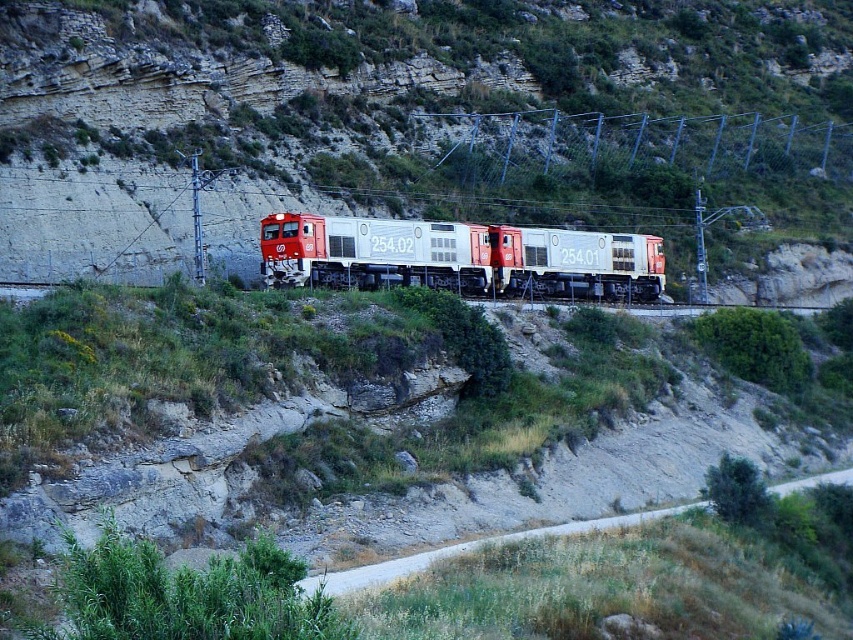
Between silver metallic locomotive at center and dirt road at lower right, which one has more height?

Standing taller between the two is silver metallic locomotive at center.

Does silver metallic locomotive at center lie behind dirt road at lower right?

Yes.

Is point (641, 284) positioned before point (654, 518)?

No, it is behind (654, 518).

Find the location of a particular element. The image size is (853, 640). silver metallic locomotive at center is located at coordinates (575, 262).

Can you confirm if matte white train at center is smaller than silver metallic locomotive at center?

Actually, matte white train at center might be larger than silver metallic locomotive at center.

Measure the distance between matte white train at center and camera.

They are 57.15 meters apart.

Where is `matte white train at center`? Image resolution: width=853 pixels, height=640 pixels. matte white train at center is located at coordinates (405, 118).

Is point (267, 241) closer to camera compared to point (556, 532)?

No, it is behind (556, 532).

This screenshot has height=640, width=853. What are the coordinates of `red and white locomotive at center` in the screenshot? It's located at 459,257.